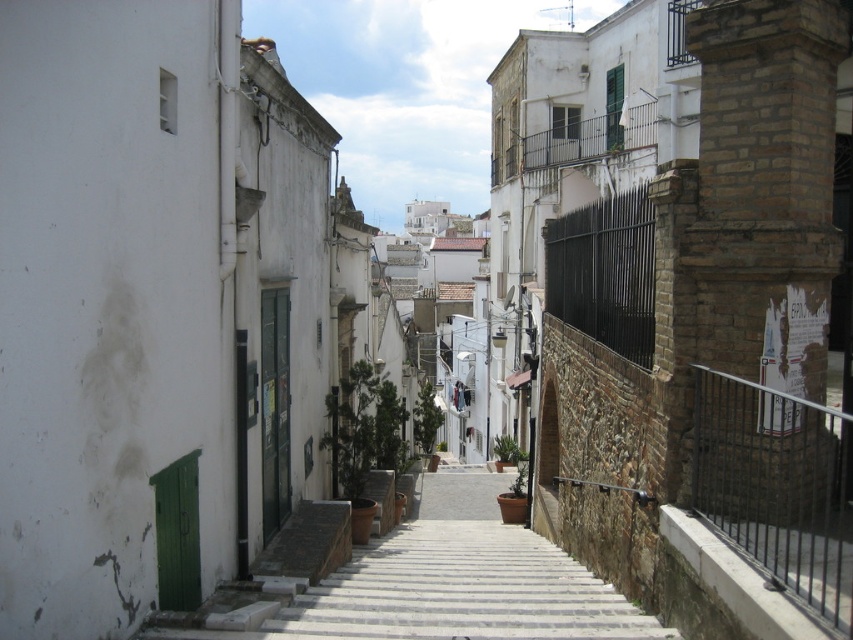
You are standing at the entrance of a shop on the left side of the street and want to walk to the point marked by point [434,584]. What is the closest object you need to navigate around to reach it?

The point [434,584] is located on the white concrete stairs at center, so you need to navigate around the white concrete stairs at center to reach it.

You are a delivery person carrying a large package that is 2 meters wide. You need to navigate through the narrow street and pass between the white concrete stairs at center and the black metal fence at right. Can your package fit through the space between them without tilting it sideways?

The distance between the white concrete stairs at center and the black metal fence at right is 2.60 meters. Since your package is 2 meters wide, it can fit through the space as the gap is wider than the package.

In the scene shown: You are a delivery person carrying a large package that requires a clear path. You see the white concrete stairs at center and the black metal fence at right. Which object provides a wider pathway for your delivery route?

The white concrete stairs at center has a larger size compared to the black metal fence at right, so it provides a wider pathway for the delivery route.